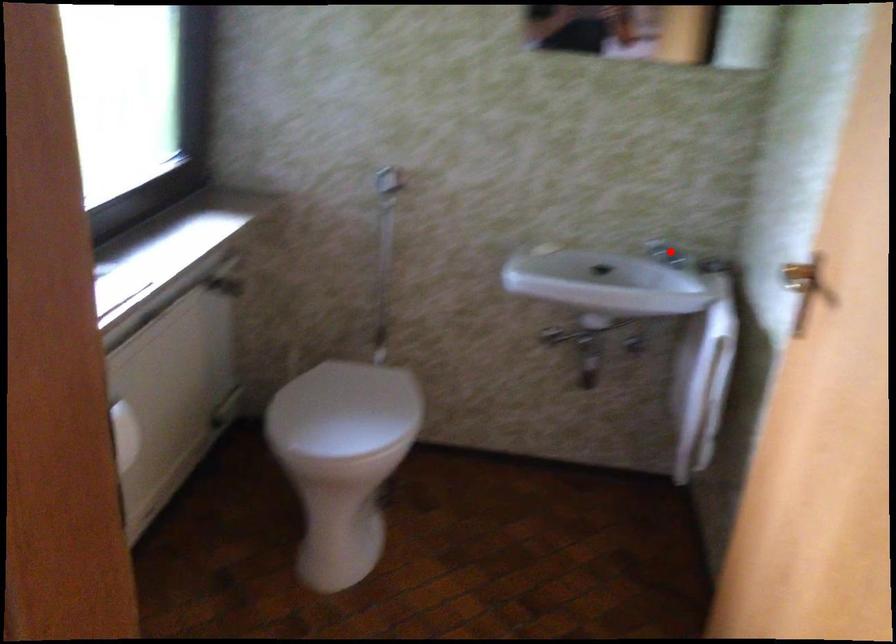
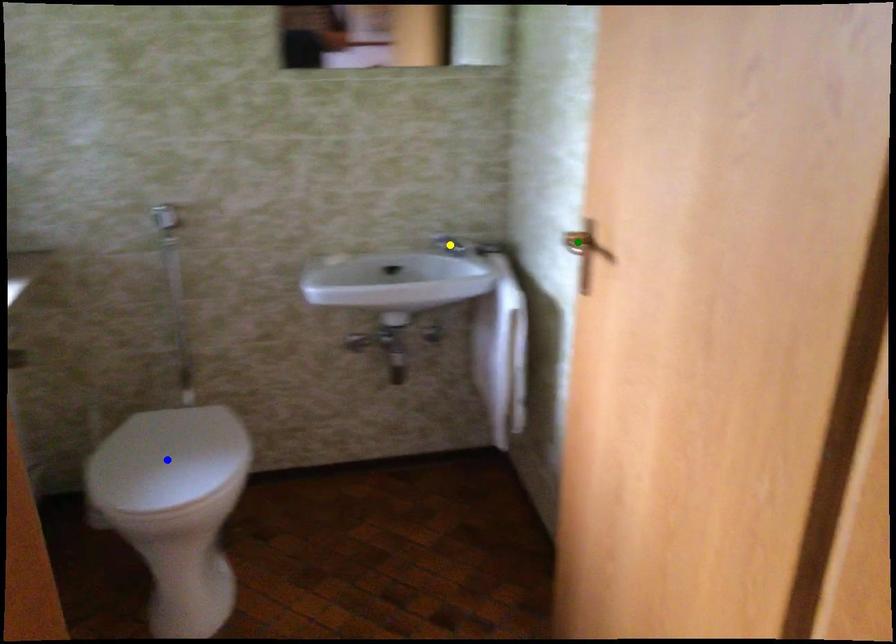
Question: I am providing you with two images of the same scene from different viewpoints. A red point is marked on the first image. You are given multiple points on the second image. Can you choose the point in image 2 that corresponds to the point in image 1?

Choices:
 (A) green point
 (B) blue point
 (C) yellow point

Answer: (C)